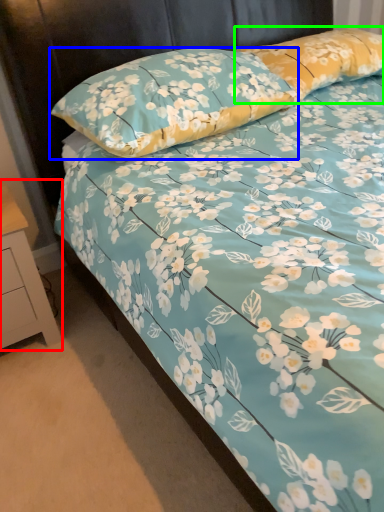
Question: Based on their relative distances, which object is farther from nightstand (highlighted by a red box)? Choose from pillow (highlighted by a blue box) and pillow (highlighted by a green box).

Choices:
 (A) pillow
 (B) pillow

Answer: (B)